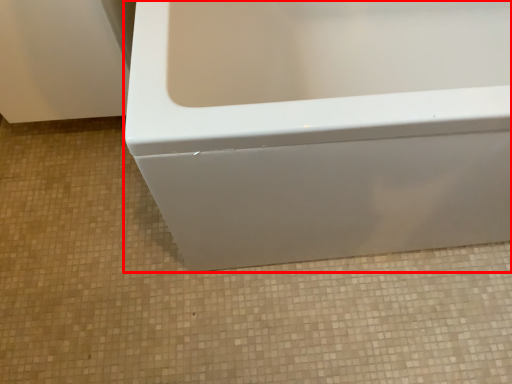
Question: Where is bathtub (annotated by the red box) located in relation to ceramic tile in the image?

Choices:
 (A) right
 (B) left

Answer: (A)